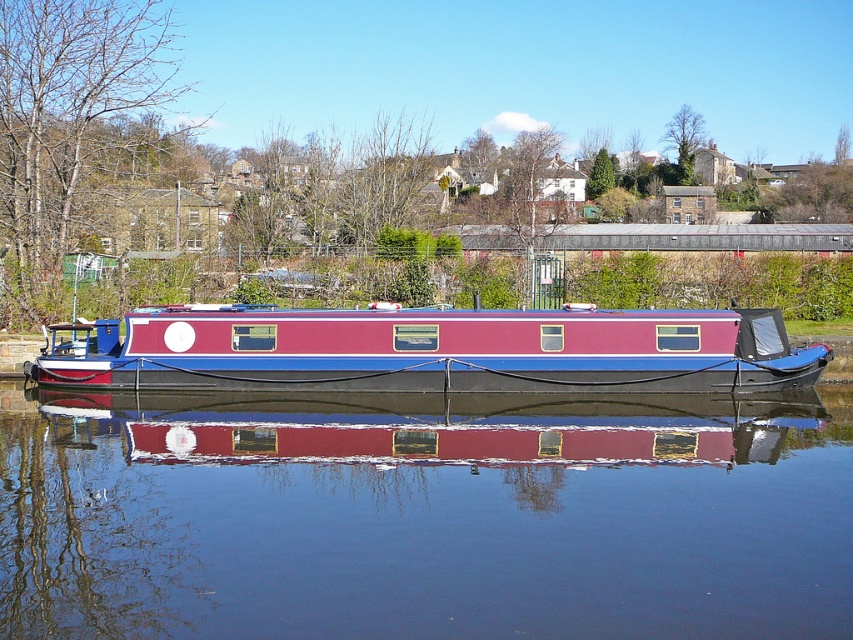
Can you confirm if glossy blue water at center is shorter than matte red and blue boat at center?

Correct, glossy blue water at center is not as tall as matte red and blue boat at center.

Image resolution: width=853 pixels, height=640 pixels. Find the location of `glossy blue water at center`. glossy blue water at center is located at coordinates (422, 518).